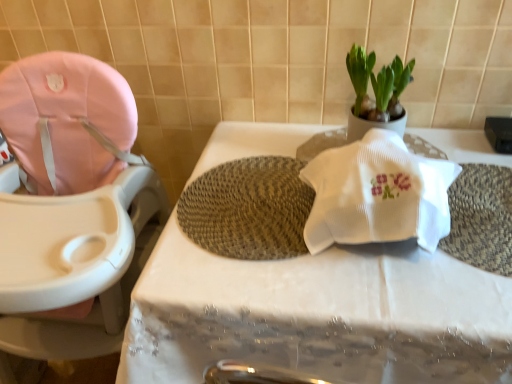
Image resolution: width=512 pixels, height=384 pixels. Identify the location of empty space that is to the right of white matte pot at upper right. (440, 145).